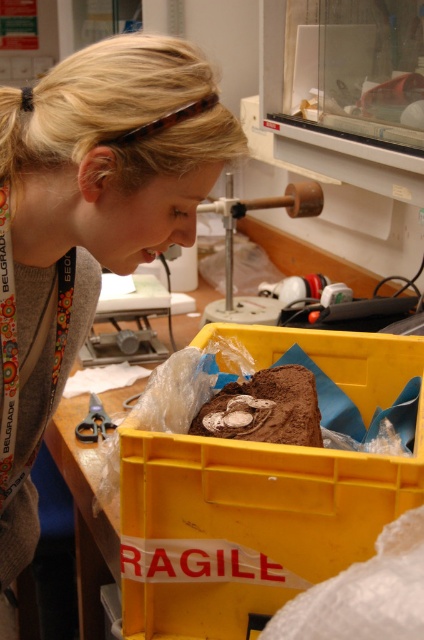
Which is below, wooden handle at upper center or metallic scissors at lower left?

Positioned lower is metallic scissors at lower left.

Describe the element at coordinates (233, 248) in the screenshot. Image resolution: width=424 pixels, height=640 pixels. I see `wooden handle at upper center` at that location.

This screenshot has height=640, width=424. I want to click on wooden handle at upper center, so point(233,248).

Can you confirm if yellow plastic crate at lower center is positioned below metallic scissors at lower left?

Incorrect, yellow plastic crate at lower center is not positioned below metallic scissors at lower left.

Is point (247, 630) farther from camera compared to point (97, 416)?

No, it is not.

The image size is (424, 640). Identify the location of yellow plastic crate at lower center. (245, 525).

Who is positioned more to the right, blonde hair at upper left or yellow plastic crate at lower center?

yellow plastic crate at lower center

Does blonde hair at upper left have a larger size compared to yellow plastic crate at lower center?

Yes.

Who is more forward, (47, 211) or (137, 464)?

Point (47, 211)

The height and width of the screenshot is (640, 424). What are the coordinates of `blonde hair at upper left` in the screenshot? It's located at (89, 220).